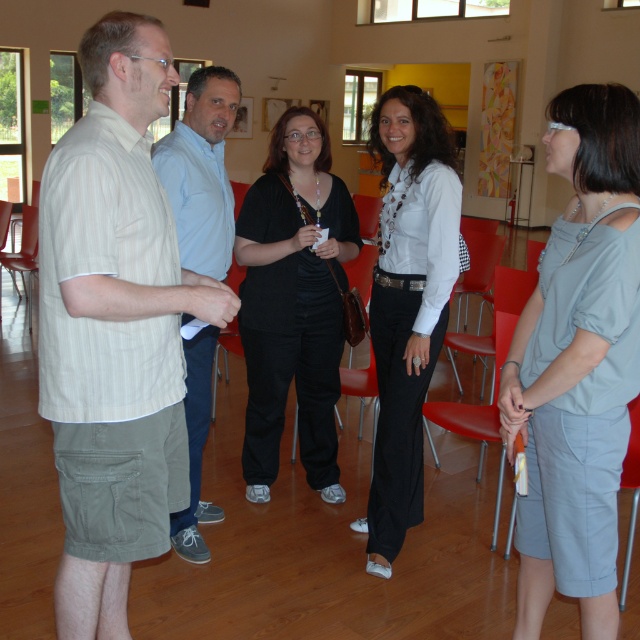
Is white glossy shirt at center wider than matte plastic chair at lower left?

In fact, white glossy shirt at center might be narrower than matte plastic chair at lower left.

Is point (380, 307) closer to camera compared to point (20, 276)?

Yes, point (380, 307) is closer to viewer.

What do you see at coordinates (406, 301) in the screenshot?
I see `white glossy shirt at center` at bounding box center [406, 301].

Image resolution: width=640 pixels, height=640 pixels. I want to click on white glossy shirt at center, so click(406, 301).

Which is below, white glossy shirt at center or light blue fabric skirt at lower right?

light blue fabric skirt at lower right is lower down.

Is white glossy shirt at center taller than light blue fabric skirt at lower right?

Yes.

The width and height of the screenshot is (640, 640). I want to click on white glossy shirt at center, so click(406, 301).

Who is taller, light blue shirt at center or light blue fabric skirt at lower right?

Standing taller between the two is light blue shirt at center.

Does point (214, 68) come in front of point (632, 516)?

No, (214, 68) is behind (632, 516).

Find the location of `light blue shirt at center`. light blue shirt at center is located at coordinates (202, 172).

Where is `light blue shirt at center`? This screenshot has width=640, height=640. light blue shirt at center is located at coordinates (202, 172).